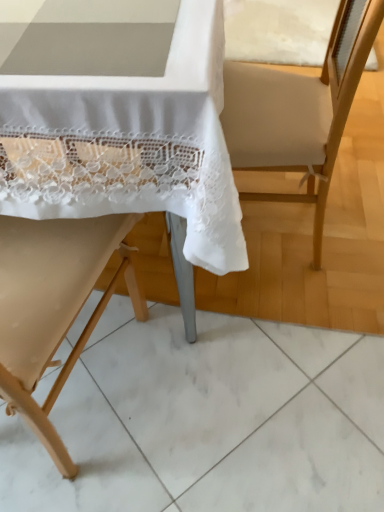
Question: Is the depth of beige fabric chair at left, which is counted as the 1th chair, starting from the bottom, less than that of beige wood chair at center, which appears as the 1th chair when viewed from the top?

Choices:
 (A) yes
 (B) no

Answer: (A)

Question: Considering the relative sizes of beige fabric chair at left, the second chair in the top-to-bottom sequence, and beige wood chair at center, positioned as the second chair in bottom-to-top order, in the image provided, is beige fabric chair at left, the second chair in the top-to-bottom sequence, bigger than beige wood chair at center, positioned as the second chair in bottom-to-top order,?

Choices:
 (A) yes
 (B) no

Answer: (B)

Question: Considering the relative positions of beige fabric chair at left, the second chair in the top-to-bottom sequence, and beige wood chair at center, which appears as the 1th chair when viewed from the top, in the image provided, is beige fabric chair at left, the second chair in the top-to-bottom sequence, to the left of beige wood chair at center, which appears as the 1th chair when viewed from the top, from the viewer's perspective?

Choices:
 (A) no
 (B) yes

Answer: (B)

Question: Is beige wood chair at center, which appears as the 1th chair when viewed from the top, inside beige fabric chair at left, the second chair in the top-to-bottom sequence?

Choices:
 (A) no
 (B) yes

Answer: (A)

Question: Is beige fabric chair at left, which is counted as the 1th chair, starting from the bottom, far away from beige wood chair at center, positioned as the second chair in bottom-to-top order?

Choices:
 (A) no
 (B) yes

Answer: (A)

Question: From a real-world perspective, is beige wood chair at center, which appears as the 1th chair when viewed from the top, physically located above or below beige fabric chair at left, the second chair in the top-to-bottom sequence?

Choices:
 (A) above
 (B) below

Answer: (B)

Question: Considering the relative positions of beige wood chair at center, positioned as the second chair in bottom-to-top order, and beige fabric chair at left, which is counted as the 1th chair, starting from the bottom, in the image provided, is beige wood chair at center, positioned as the second chair in bottom-to-top order, to the left or to the right of beige fabric chair at left, which is counted as the 1th chair, starting from the bottom,?

Choices:
 (A) right
 (B) left

Answer: (A)

Question: In terms of size, does beige wood chair at center, which appears as the 1th chair when viewed from the top, appear bigger or smaller than beige fabric chair at left, the second chair in the top-to-bottom sequence?

Choices:
 (A) small
 (B) big

Answer: (B)

Question: In terms of height, does beige wood chair at center, which appears as the 1th chair when viewed from the top, look taller or shorter compared to beige fabric chair at left, the second chair in the top-to-bottom sequence?

Choices:
 (A) tall
 (B) short

Answer: (B)

Question: Is beige wood chair at center, positioned as the second chair in bottom-to-top order, bigger or smaller than beige fabric armchair at center?

Choices:
 (A) big
 (B) small

Answer: (A)

Question: From the image's perspective, relative to beige fabric armchair at center, is beige wood chair at center, which appears as the 1th chair when viewed from the top, above or below?

Choices:
 (A) above
 (B) below

Answer: (A)

Question: Is point (268, 275) positioned closer to the camera than point (314, 147)?

Choices:
 (A) closer
 (B) farther

Answer: (B)

Question: From a real-world perspective, is beige wood chair at center, which appears as the 1th chair when viewed from the top, above or below beige fabric armchair at center?

Choices:
 (A) above
 (B) below

Answer: (A)

Question: Is beige fabric armchair at center bigger or smaller than beige fabric chair at left, the second chair in the top-to-bottom sequence?

Choices:
 (A) small
 (B) big

Answer: (A)

Question: From the image's perspective, is beige fabric armchair at center positioned above or below beige fabric chair at left, the second chair in the top-to-bottom sequence?

Choices:
 (A) below
 (B) above

Answer: (B)